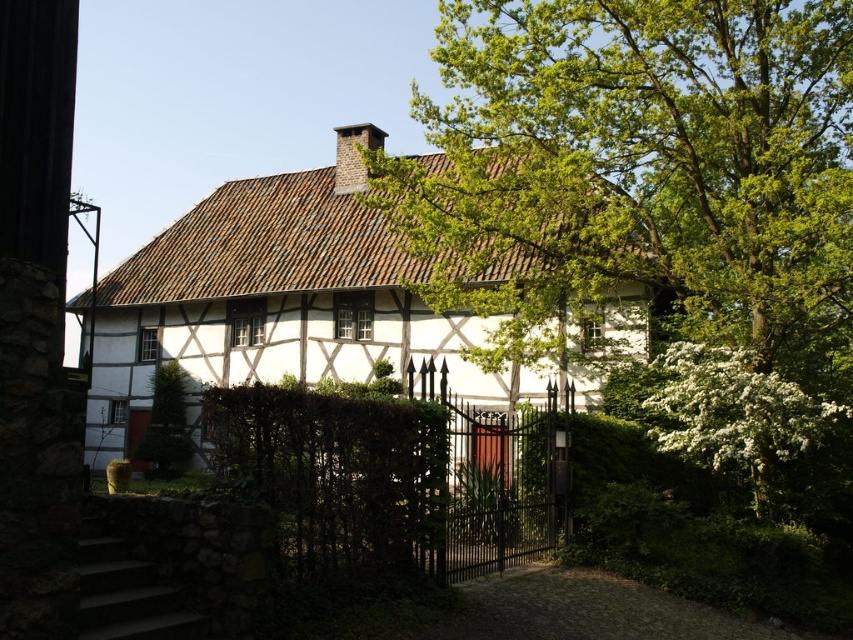
Is point (561, 115) behind point (358, 244)?

No, it is not.

Between green leafy tree at upper right and white wooden cottage at center, which one has less height?

white wooden cottage at center

Between point (695, 285) and point (345, 339), which one is positioned in front?

Point (695, 285)

In order to click on green leafy tree at upper right in this screenshot , I will do `click(637, 170)`.

Does brown wooden door at center have a lesser height compared to brown wooden door at lower left?

Correct, brown wooden door at center is not as tall as brown wooden door at lower left.

Can you confirm if brown wooden door at center is positioned to the right of brown wooden door at lower left?

Correct, you'll find brown wooden door at center to the right of brown wooden door at lower left.

Image resolution: width=853 pixels, height=640 pixels. Describe the element at coordinates (491, 445) in the screenshot. I see `brown wooden door at center` at that location.

This screenshot has height=640, width=853. I want to click on brown wooden door at center, so click(491, 445).

Can you confirm if brown wooden door at center is shorter than dark gray brick chimney at upper center?

Yes, brown wooden door at center is shorter than dark gray brick chimney at upper center.

Is brown wooden door at center to the right of dark gray brick chimney at upper center from the viewer's perspective?

Indeed, brown wooden door at center is positioned on the right side of dark gray brick chimney at upper center.

Which is behind, point (506, 435) or point (345, 193)?

The point (345, 193) is more distant.

This screenshot has width=853, height=640. In order to click on brown wooden door at center in this screenshot , I will do `click(491, 445)`.